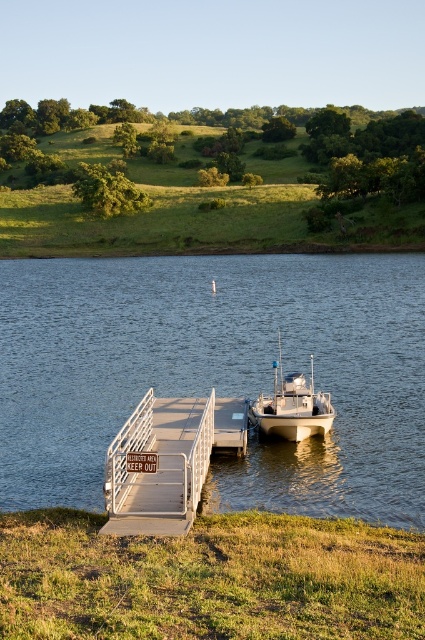
Which is in front, point (274, 282) or point (277, 243)?

Point (274, 282) is in front.

Does clear water at dock right appear over green grassy hillside at upper center?

Incorrect, clear water at dock right is not positioned above green grassy hillside at upper center.

Who is more forward, (356, 472) or (405, 180)?

Point (356, 472) is more forward.

This screenshot has height=640, width=425. Identify the location of clear water at dock right. (217, 372).

Which of these two, clear water at dock right or white metal dock at center, stands taller?

clear water at dock right

Who is positioned more to the left, clear water at dock right or white metal dock at center?

white metal dock at center is more to the left.

Describe the element at coordinates (217, 372) in the screenshot. The image size is (425, 640). I see `clear water at dock right` at that location.

Image resolution: width=425 pixels, height=640 pixels. I want to click on clear water at dock right, so click(x=217, y=372).

Can you confirm if clear water at dock right is taller than white matte boat at center?

Yes.

Does point (295, 465) come closer to viewer compared to point (286, 394)?

Yes, it is in front of point (286, 394).

What do you see at coordinates (217, 372) in the screenshot?
I see `clear water at dock right` at bounding box center [217, 372].

Locate an element on the screen. clear water at dock right is located at coordinates (217, 372).